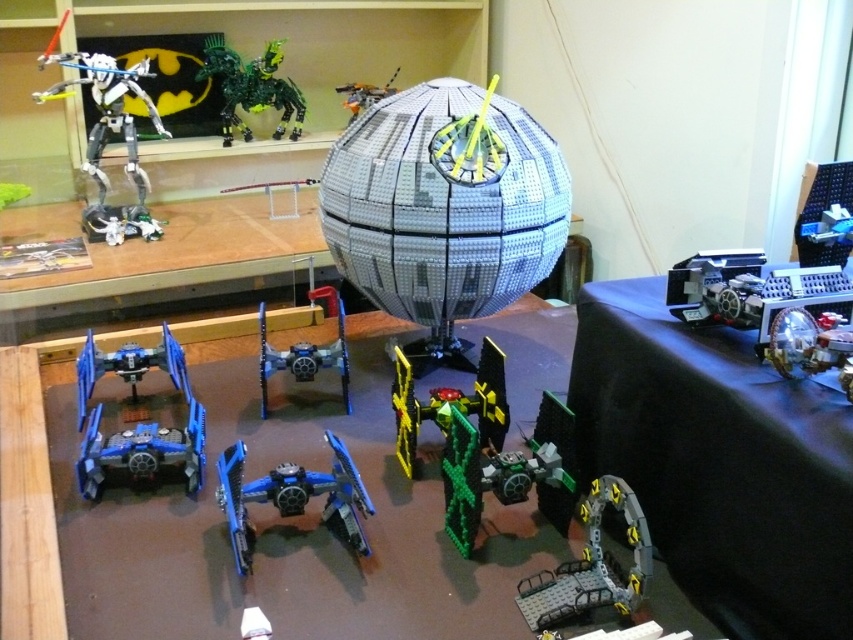
Question: Which point is closer to the camera?

Choices:
 (A) (369, 100)
 (B) (129, 156)
 (C) (496, 147)

Answer: (C)

Question: Can you confirm if translucent yellow plastic gear at lower right is positioned below green metallic robot at upper center?

Choices:
 (A) no
 (B) yes

Answer: (B)

Question: Which object is positioned farthest from the blue plastic spaceship at center?

Choices:
 (A) blue plastic fighter jet at lower left
 (B) metallic silver spaceship at upper center
 (C) gray plastic sphere at center
 (D) translucent yellow plastic gear at lower right

Answer: (B)

Question: In this image, where is blue plastic spaceship at center located relative to metallic silver spaceship at upper center?

Choices:
 (A) below
 (B) above

Answer: (A)

Question: Does matte black robot at left have a lesser width compared to green metallic robot at upper center?

Choices:
 (A) no
 (B) yes

Answer: (A)

Question: Which object is the closest to the blue plastic fighter jet at lower left?

Choices:
 (A) blue plastic spaceship at center
 (B) yellow-green plastic robot at center
 (C) metallic silver spaceship at upper center

Answer: (A)